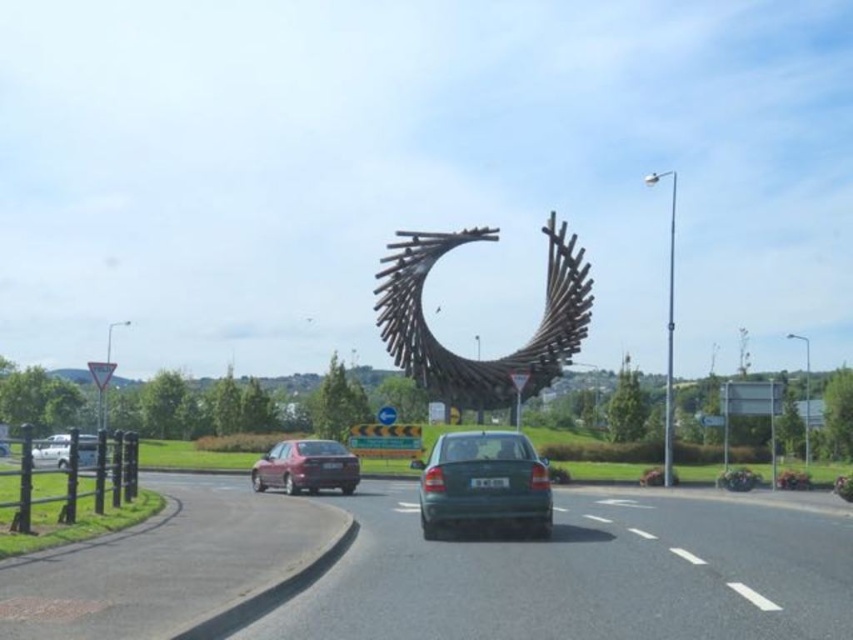
Which of these two, matte red sedan at left or white matte van at lower left, stands taller?

white matte van at lower left is taller.

Does matte red sedan at left have a smaller size compared to white matte van at lower left?

Yes.

Describe the element at coordinates (306, 467) in the screenshot. The height and width of the screenshot is (640, 853). I see `matte red sedan at left` at that location.

Find the location of a particular element. The image size is (853, 640). matte red sedan at left is located at coordinates (306, 467).

Can you confirm if wooden sculpture at center is taller than matte red sedan at left?

Yes, wooden sculpture at center is taller than matte red sedan at left.

Between wooden sculpture at center and matte red sedan at left, which one is positioned lower?

Positioned lower is matte red sedan at left.

Identify the location of wooden sculpture at center. Image resolution: width=853 pixels, height=640 pixels. (479, 358).

At what (x,y) coordinates should I click in order to perform the action: click on wooden sculpture at center. Please return your answer as a coordinate pair (x, y). Looking at the image, I should click on (479, 358).

How distant is green matte car at center from matte red sedan at left?

A distance of 108.97 feet exists between green matte car at center and matte red sedan at left.

Is green matte car at center thinner than matte red sedan at left?

Yes.

Locate an element on the screen. The width and height of the screenshot is (853, 640). green matte car at center is located at coordinates (483, 483).